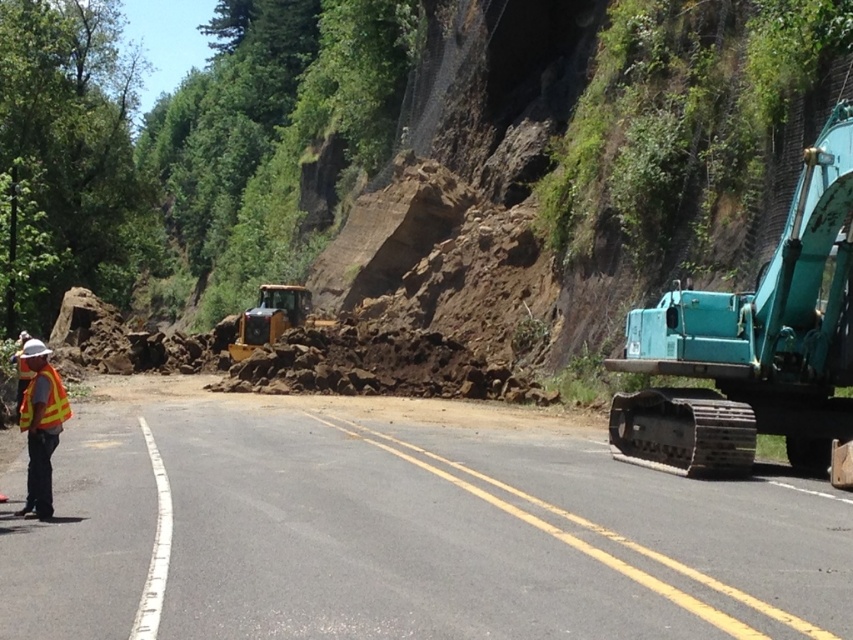
Does black asphalt road at lower left have a lesser width compared to yellow reflective vest at left?

Incorrect, black asphalt road at lower left's width is not less than yellow reflective vest at left's.

Does point (509, 486) come behind point (39, 417)?

That is True.

The height and width of the screenshot is (640, 853). What do you see at coordinates (401, 528) in the screenshot? I see `black asphalt road at lower left` at bounding box center [401, 528].

Locate an element on the screen. This screenshot has width=853, height=640. black asphalt road at lower left is located at coordinates (401, 528).

Is black asphalt road at lower left to the left of reflective yellow safety vest at left from the viewer's perspective?

Incorrect, black asphalt road at lower left is not on the left side of reflective yellow safety vest at left.

At what (x,y) coordinates should I click in order to perform the action: click on black asphalt road at lower left. Please return your answer as a coordinate pair (x, y). Looking at the image, I should click on (401, 528).

What are the coordinates of `black asphalt road at lower left` in the screenshot? It's located at (401, 528).

Looking at this image, is black asphalt road at lower left below yellow rubber tractor at center?

Yes, black asphalt road at lower left is below yellow rubber tractor at center.

This screenshot has width=853, height=640. Describe the element at coordinates (401, 528) in the screenshot. I see `black asphalt road at lower left` at that location.

What are the coordinates of `black asphalt road at lower left` in the screenshot? It's located at (401, 528).